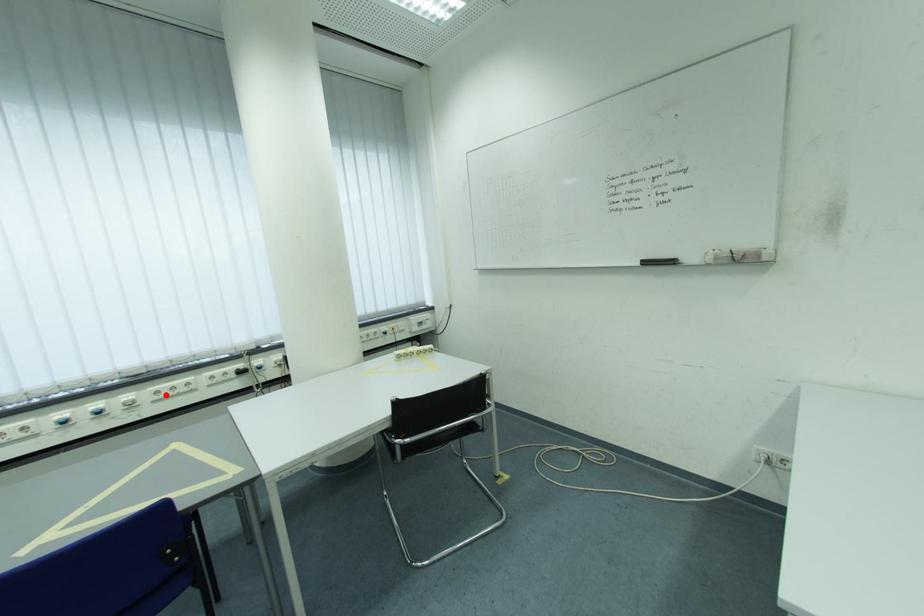
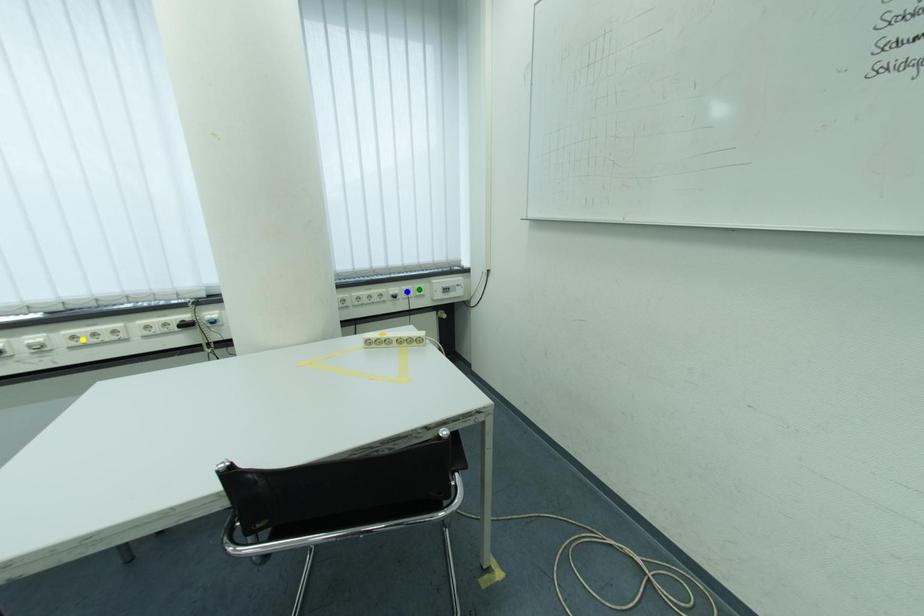
Question: I am providing you with two images of the same scene from different viewpoints. A red point is marked on the first image. You are given multiple points on the second image. In image 2, which mark is for the same physical point as the one in image 1?

Choices:
 (A) yellow point
 (B) blue point
 (C) green point

Answer: (A)